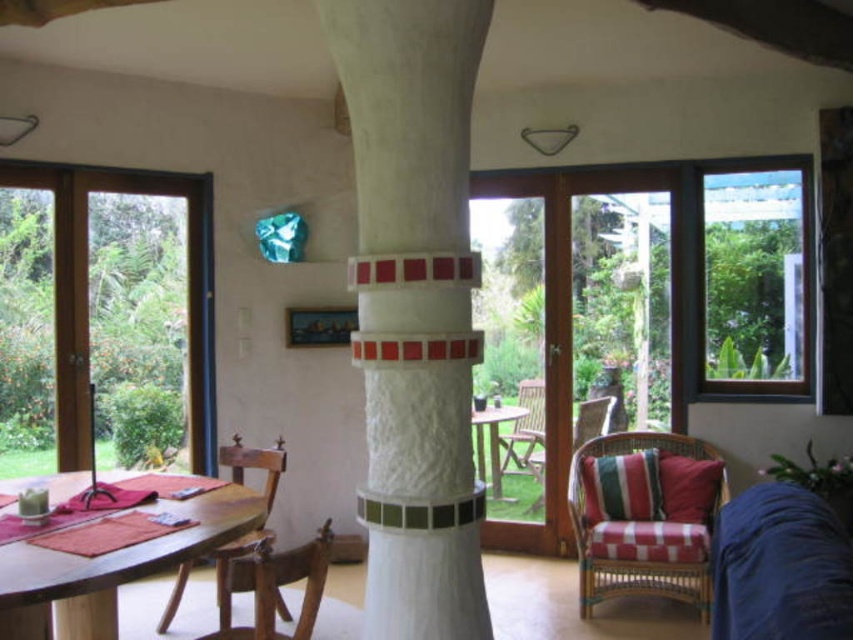
You are planning to rearrange the furniture in this room. If you want to place the wooden table at center between the wooden chair at lower left and another chair of the same size, will there be enough space?

The wooden chair at lower left is larger in size than the wooden table at center. Therefore, placing the wooden table at center between two chairs of the same size would require sufficient space since the table is smaller than the chairs, but the total space needed depends on the distance between them. However, based on the given information, the table is smaller, so it might fit between the two chairs.

You are sitting in the woven rattan armchair at lower right and want to reach the wooden armchair at lower left. Is the path between them clear?

The woven rattan armchair at lower right is located below the wooden armchair at lower left, so there is a clear path between them as they are positioned vertically.

You are a guest entering the room and want to sit at the wooden table at center. Which direction should you move from the wooden chair at lower left to reach the table?

The wooden chair at lower left is to the left of the wooden table at center, so you should move to the right to reach the table.